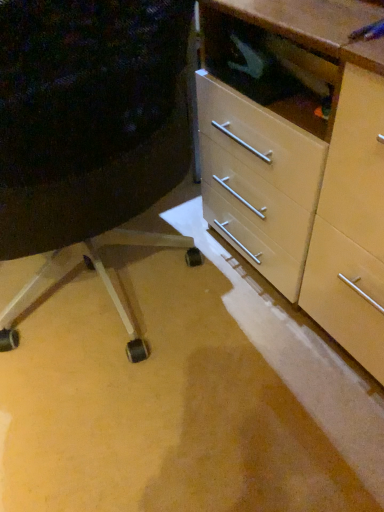
Locate an element on the screen. The height and width of the screenshot is (512, 384). vacant space underneath matte plastic drawer at center-right (from a real-world perspective) is located at coordinates (113, 313).